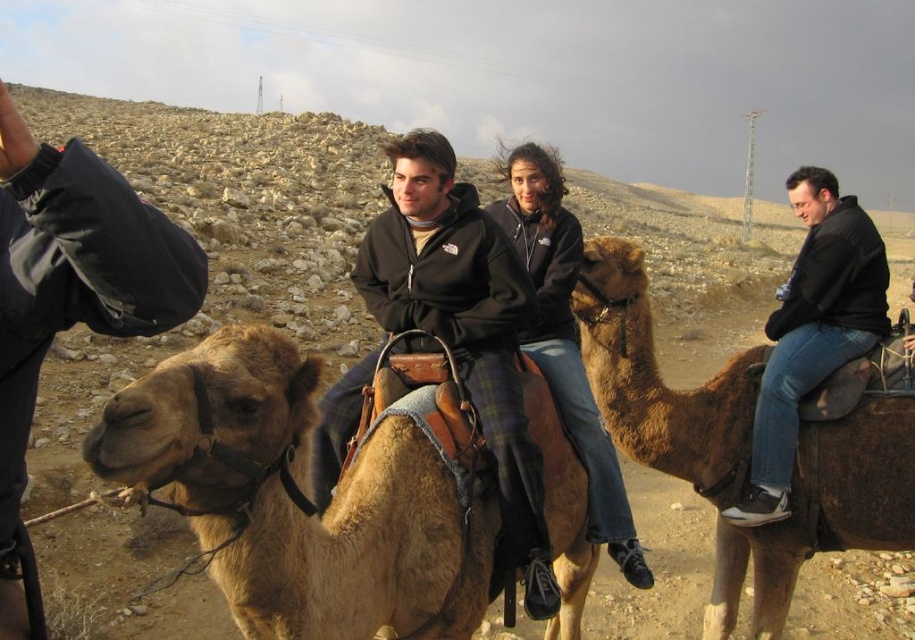
Question: Is light brown leather camel at center smaller than matte black jacket at upper left?

Choices:
 (A) yes
 (B) no

Answer: (B)

Question: Which of the following is the farthest from the observer?

Choices:
 (A) click(x=779, y=525)
 (B) click(x=466, y=378)

Answer: (A)

Question: Is brown fuzzy camel at right to the left of matte black jacket at center from the viewer's perspective?

Choices:
 (A) no
 (B) yes

Answer: (A)

Question: Which of the following is the closest to the observer?

Choices:
 (A) light brown leather camel at center
 (B) matte black jacket at center
 (C) brown fuzzy camel at right

Answer: (A)

Question: Considering the relative positions of brown fuzzy camel at right and dark brown leather jacket at center in the image provided, where is brown fuzzy camel at right located with respect to dark brown leather jacket at center?

Choices:
 (A) below
 (B) above

Answer: (A)

Question: Which object is positioned closest to the light brown leather camel at center?

Choices:
 (A) brown fuzzy camel at right
 (B) matte black jacket at center
 (C) matte black jacket at upper left

Answer: (C)